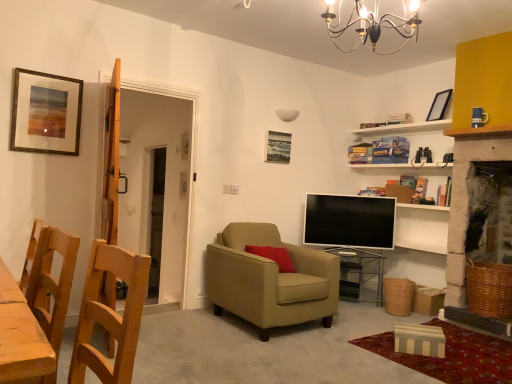
Question: Should I look upward or downward to see matte black picture frame at upper right, which ranks as the second picture frame in back-to-front order?

Choices:
 (A) down
 (B) up

Answer: (B)

Question: Is transparent glass table at center located outside metallic chandelier at upper center?

Choices:
 (A) no
 (B) yes

Answer: (B)

Question: Is transparent glass table at center closer to the viewer compared to metallic chandelier at upper center?

Choices:
 (A) no
 (B) yes

Answer: (A)

Question: Is transparent glass table at center wider than metallic chandelier at upper center?

Choices:
 (A) yes
 (B) no

Answer: (B)

Question: Can you confirm if transparent glass table at center is taller than metallic chandelier at upper center?

Choices:
 (A) no
 (B) yes

Answer: (B)

Question: Is transparent glass table at center looking in the opposite direction of metallic chandelier at upper center?

Choices:
 (A) no
 (B) yes

Answer: (A)

Question: From the image's perspective, would you say transparent glass table at center is shown under metallic chandelier at upper center?

Choices:
 (A) no
 (B) yes

Answer: (B)

Question: Can you confirm if matte black screen at center is wider than matte black picture frame at upper right, positioned as the 3th picture frame in left-to-right order?

Choices:
 (A) no
 (B) yes

Answer: (A)

Question: Can you confirm if matte black screen at center is thinner than matte black picture frame at upper right, the second picture frame when ordered from front to back?

Choices:
 (A) no
 (B) yes

Answer: (B)

Question: From the image's perspective, is matte black screen at center over matte black picture frame at upper right, the second picture frame when ordered from front to back?

Choices:
 (A) yes
 (B) no

Answer: (B)

Question: Does matte black screen at center contain matte black picture frame at upper right, arranged as the 1th picture frame when viewed from the right?

Choices:
 (A) no
 (B) yes

Answer: (A)

Question: From a real-world perspective, is matte black screen at center over matte black picture frame at upper right, which ranks as the second picture frame in back-to-front order?

Choices:
 (A) no
 (B) yes

Answer: (A)

Question: Is matte black screen at center located outside matte black picture frame at upper right, which ranks as the second picture frame in back-to-front order?

Choices:
 (A) no
 (B) yes

Answer: (B)

Question: Is the position of wooden chair at left, placed as the 1th chair when sorted from front to back, more distant than that of matte black screen at center?

Choices:
 (A) no
 (B) yes

Answer: (A)